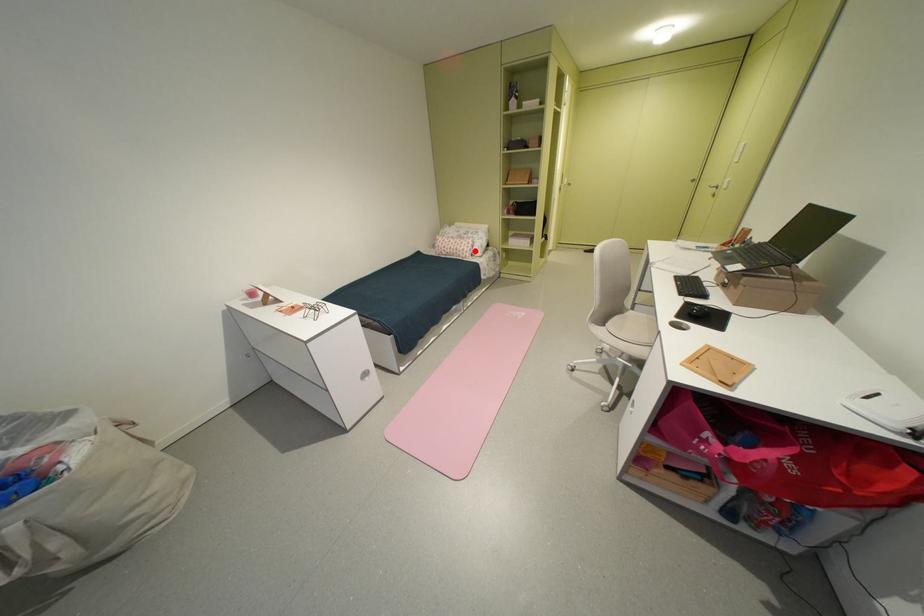
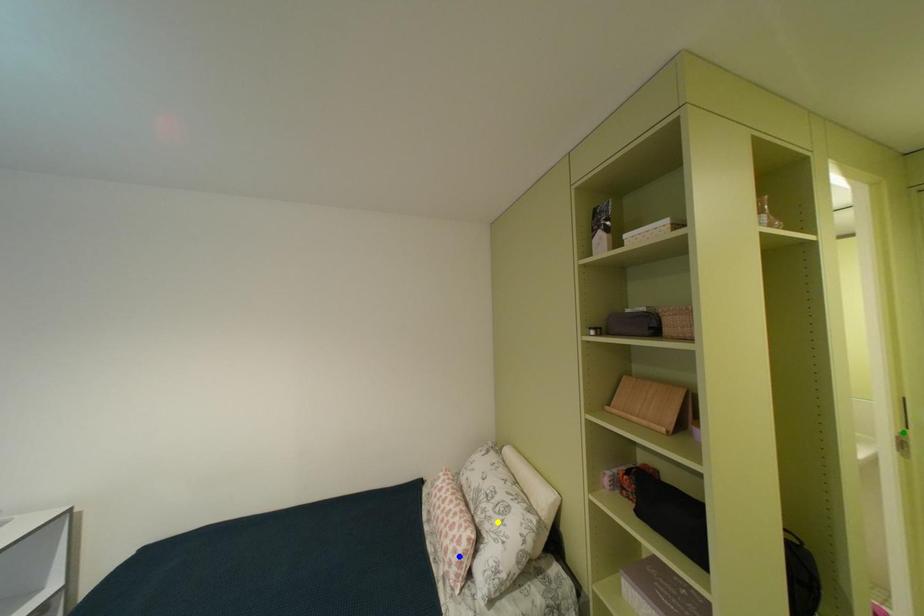
Question: I am providing you with two images of the same scene from different viewpoints. A red point is marked on the first image. You are given multiple points on the second image. Which point in image 2 represents the same 3d spot as the red point in image 1?

Choices:
 (A) green point
 (B) blue point
 (C) yellow point

Answer: (B)